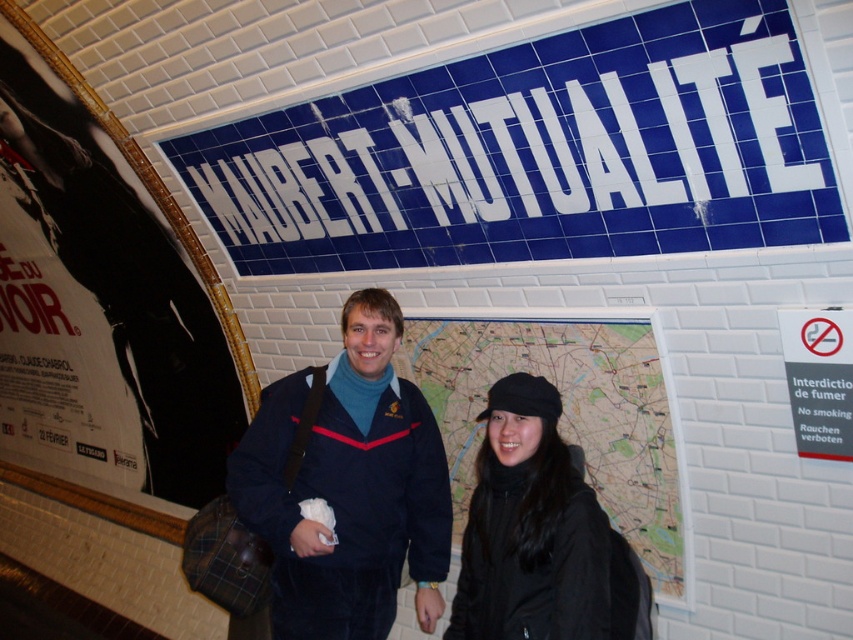
You are a subway commuter who wants to read the text on the white paper poster at left and the black matte hat at center. Since both are in your line of sight, which one can you read more clearly?

The white paper poster at left has a larger size compared to the black matte hat at center, so you can read the text on the white paper poster at left more clearly.

You are a delivery robot with a package that needs to be placed between the white paper poster at left and the velvet blue jacket at center. The package is 1.5 meters long. Can you fit the package between them?

The distance between the white paper poster at left and the velvet blue jacket at center is 1.79 meters. Since the package is 1.5 meters long, it can fit between them with some space remaining.